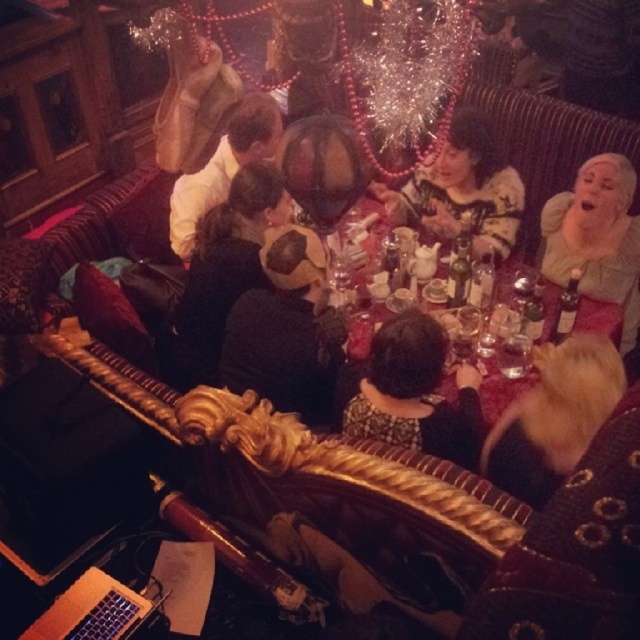
Question: Is black velvet dress at center behind matte black table at center?

Choices:
 (A) no
 (B) yes

Answer: (B)

Question: Does blonde fur coat at lower right have a lesser width compared to black velvet dress at center?

Choices:
 (A) no
 (B) yes

Answer: (A)

Question: Among these objects, which one is farthest from the camera?

Choices:
 (A) matte black table at center
 (B) black textured coat at center

Answer: (A)

Question: Which point is farther from the camera taking this photo?

Choices:
 (A) (198, 336)
 (B) (236, 316)
 (C) (364, 298)

Answer: (A)

Question: Where is blonde fur coat at lower right located in relation to green velvet dress at right in the image?

Choices:
 (A) left
 (B) right

Answer: (A)

Question: Which of the following is the farthest from the observer?

Choices:
 (A) pos(394,332)
 (B) pos(541,435)
 (C) pos(234,326)

Answer: (C)